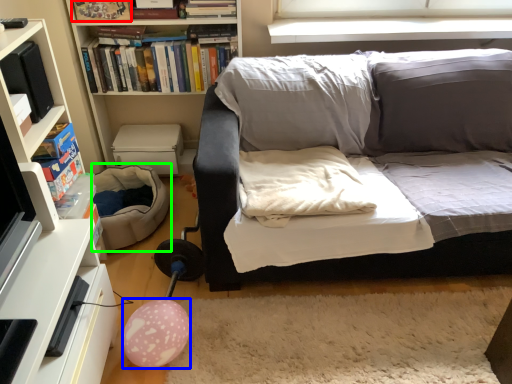
Question: Which object is positioned closest to book (highlighted by a red box)? Select from balloon (highlighted by a blue box) and bean bag chair (highlighted by a green box).

Choices:
 (A) balloon
 (B) bean bag chair

Answer: (B)